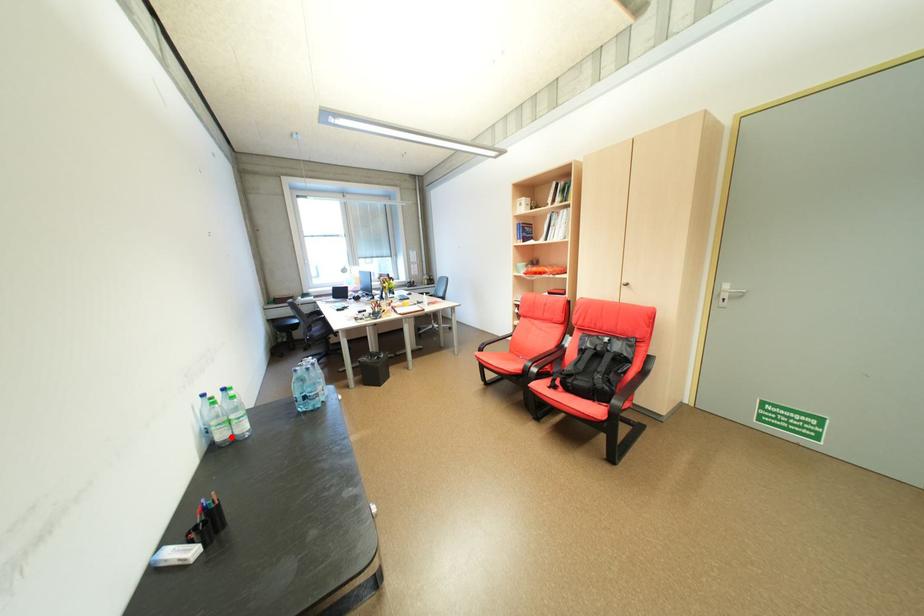
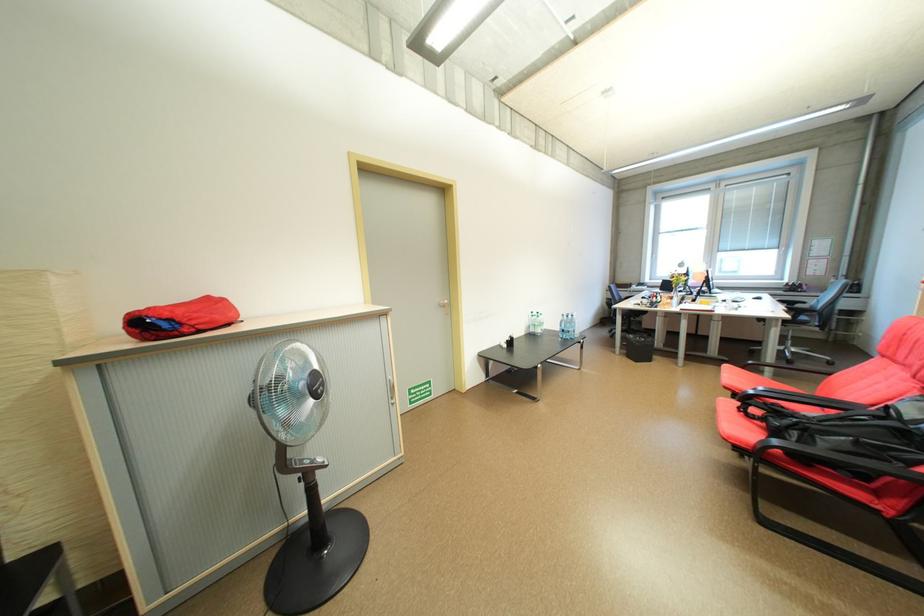
The point at the highlighted location is marked in the first image. Where is the corresponding point in the second image?

(541, 331)